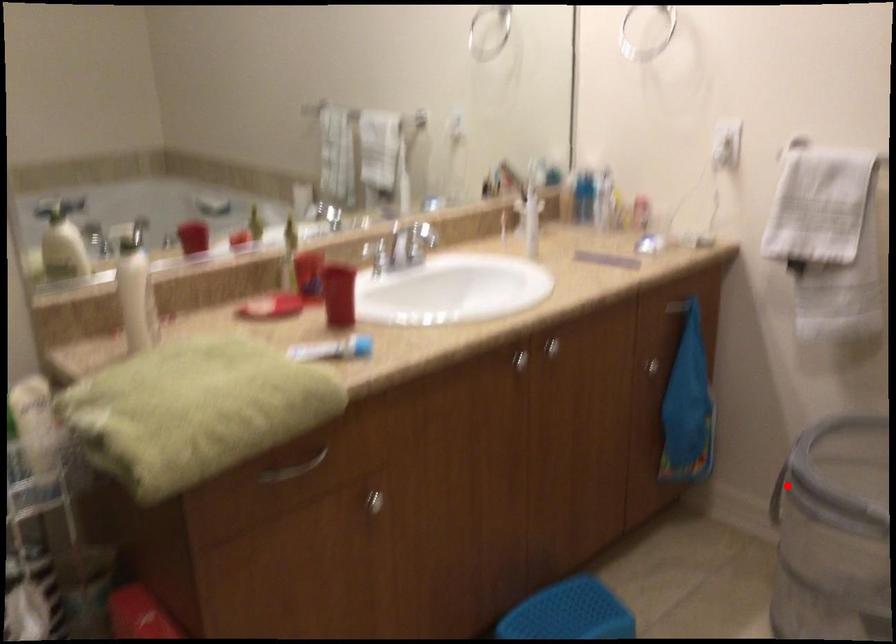
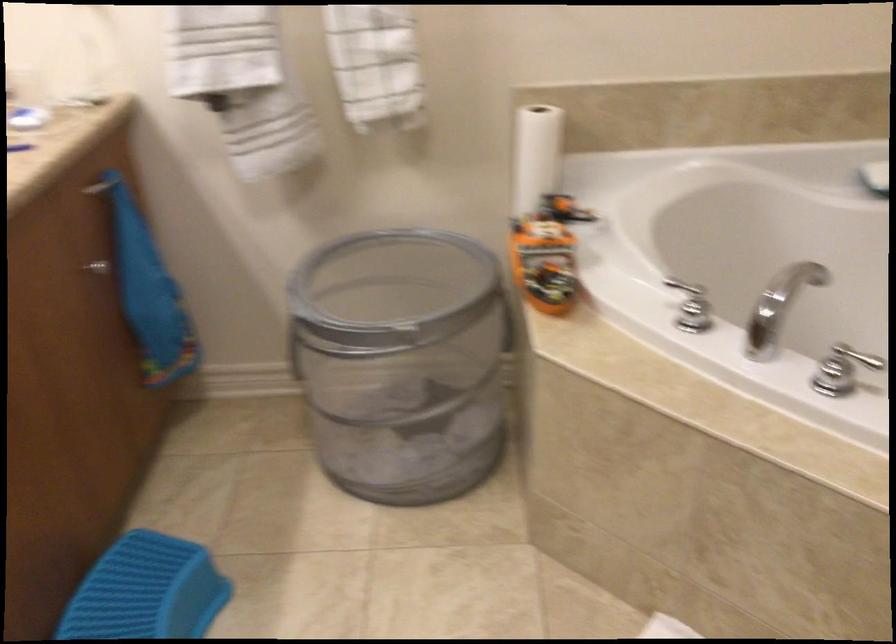
Where in the second image is the point corresponding to the highlighted location from the first image?

(303, 341)